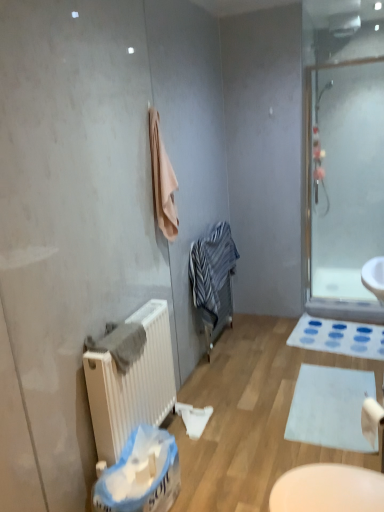
Where is `vacant area that is situated to the right of white matte radiator at lower left`? vacant area that is situated to the right of white matte radiator at lower left is located at coordinates (221, 454).